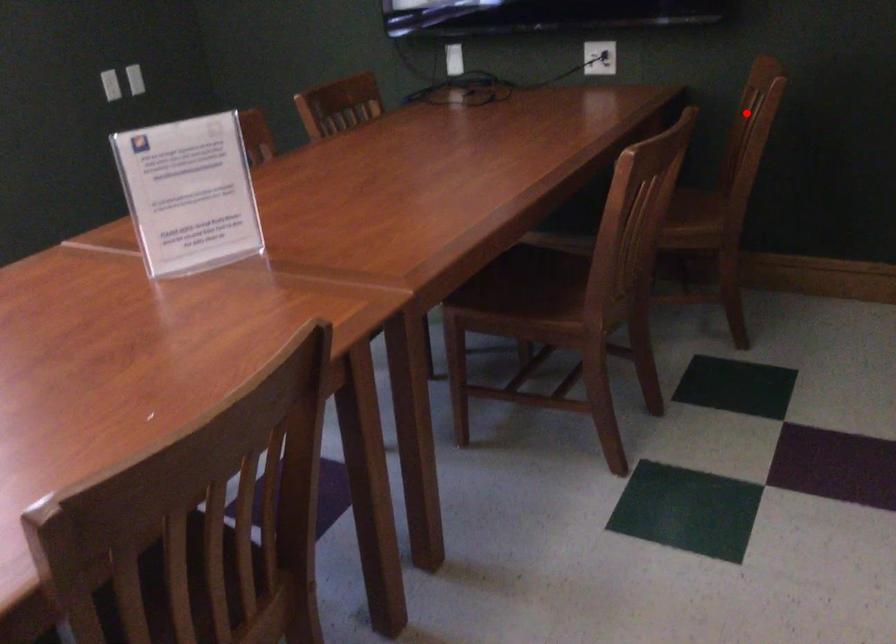
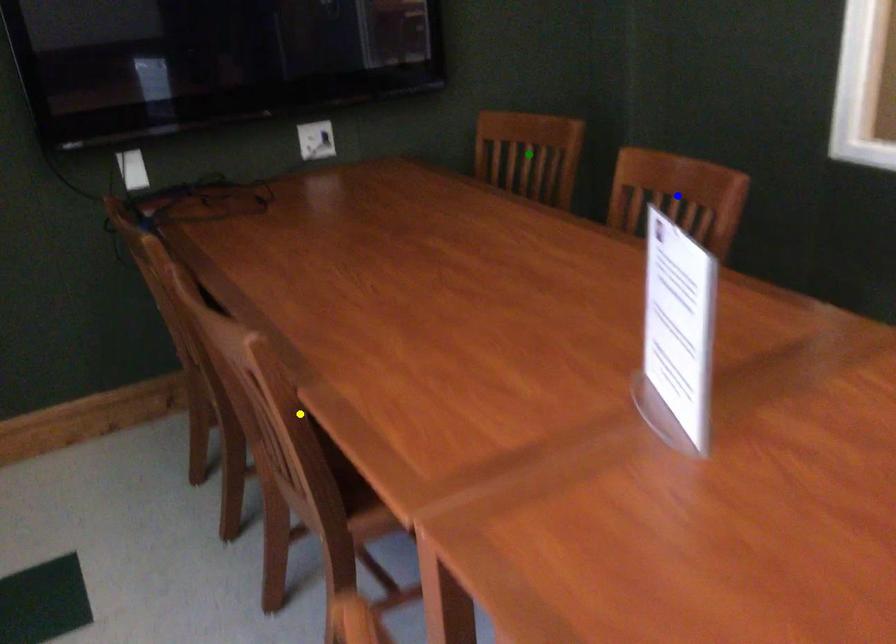
Question: I am providing you with two images of the same scene from different viewpoints. A red point is marked on the first image. You are given multiple points on the second image. Which mark in image 2 goes with the point in image 1?

Choices:
 (A) yellow point
 (B) green point
 (C) blue point

Answer: (B)